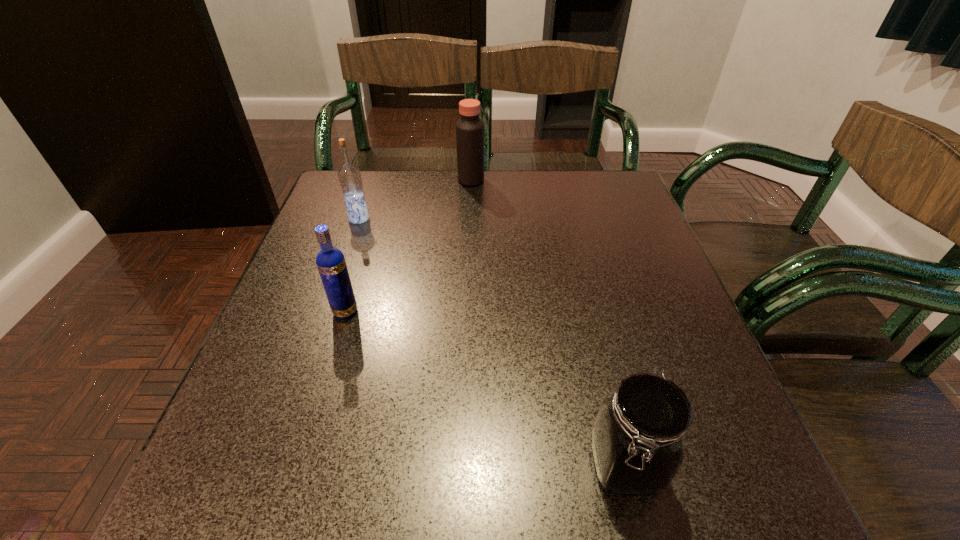
You are a GUI agent. You are given a task and a screenshot of the screen. Output one action in this format:
    pyautogui.click(x=<x>, y=<y>)
    Task: Click on the object that is the nearest to the nearer vodka
    Image resolution: width=960 pixels, height=540 pixels.
    Given the screenshot: What is the action you would take?
    pyautogui.click(x=349, y=176)

Image resolution: width=960 pixels, height=540 pixels. I want to click on vacant space that satisfies the following two spatial constraints: 1. on the back side of the third object from left to right; 2. on the left side of the second farthest object, so point(372,180).

Where is `vacant region that satisfies the following two spatial constraints: 1. on the front side of the second nearest object; 2. on the left side of the farther vodka`? This screenshot has width=960, height=540. vacant region that satisfies the following two spatial constraints: 1. on the front side of the second nearest object; 2. on the left side of the farther vodka is located at coordinates (327, 312).

Locate an element on the screen. The image size is (960, 540). vacant space that satisfies the following two spatial constraints: 1. on the back side of the farther vodka; 2. on the right side of the farthest object is located at coordinates (372, 180).